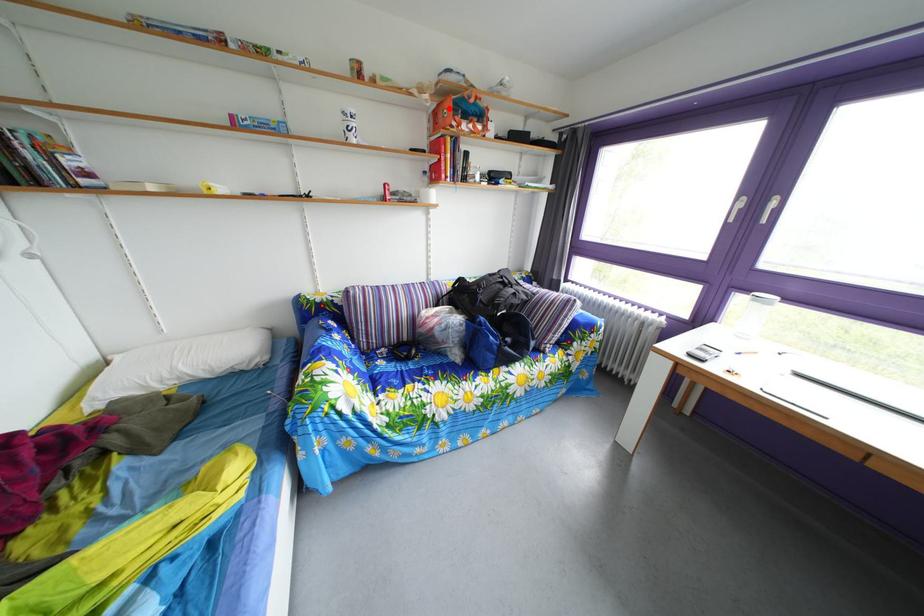
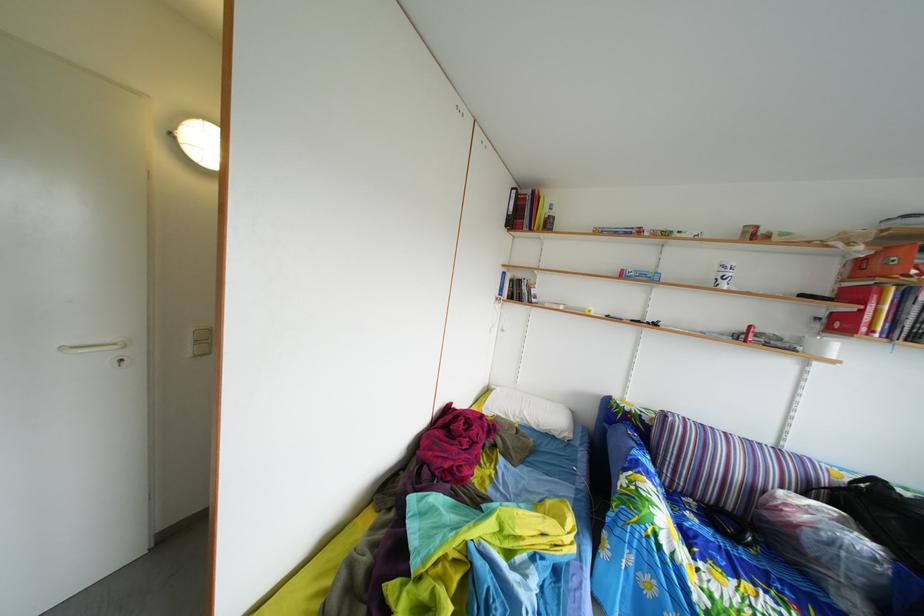
Where in the second image is the point corresponding to the highlighted location from the first image?

(892, 256)